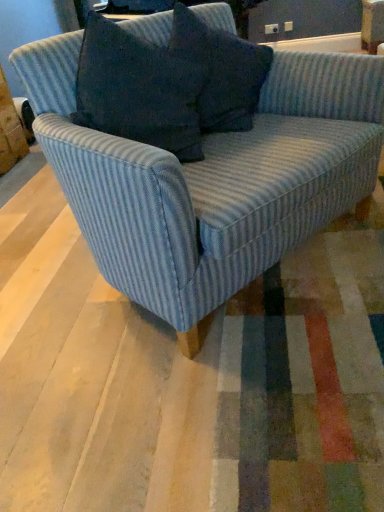
You are a GUI agent. You are given a task and a screenshot of the screen. Output one action in this format:
    pyautogui.click(x=<x>, y=<y>)
    Task: Click on the vacant region to the left of blue striped fabric couch at center
    This screenshot has width=384, height=512.
    Given the screenshot: What is the action you would take?
    pyautogui.click(x=41, y=276)